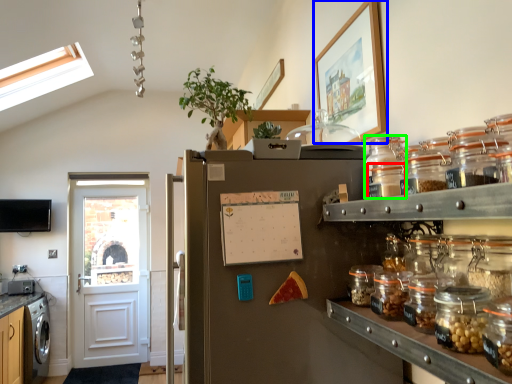
Question: Considering the real-world distances, which object is closest to glass jar (highlighted by a red box)? picture frame (highlighted by a blue box) or glass jar (highlighted by a green box).

Choices:
 (A) picture frame
 (B) glass jar

Answer: (B)